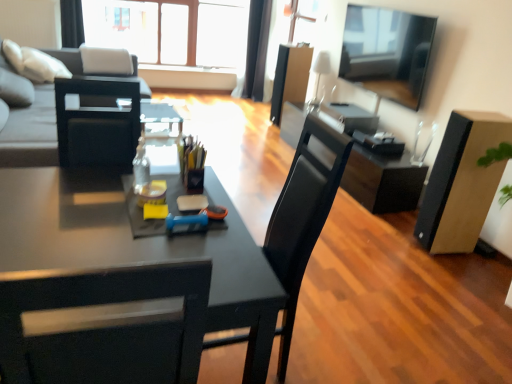
Find the location of a particular element. vacant position to the left of translucent glass bottle at center is located at coordinates (100, 186).